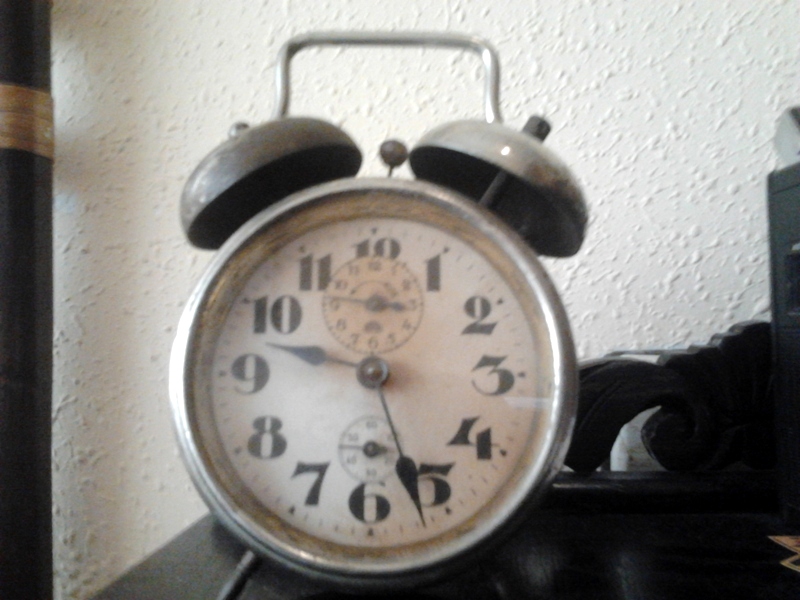
The width and height of the screenshot is (800, 600). In order to click on old school alarm clock in this screenshot , I will do `click(534, 280)`.